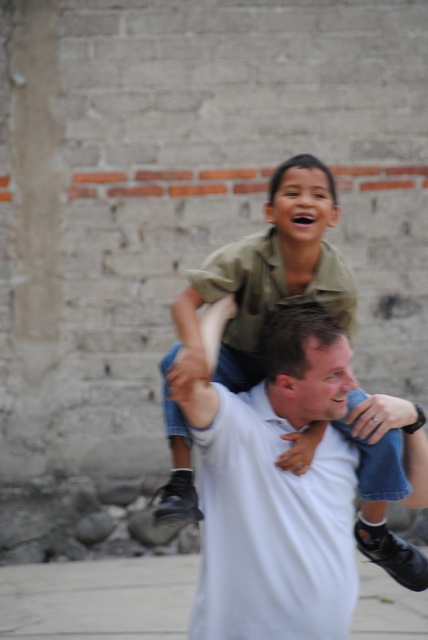
Question: Which point is closer to the camera?

Choices:
 (A) white cotton shirt at center
 (B) gray concrete pavement at lower center

Answer: (A)

Question: Is white cotton shirt at center closer to camera compared to gray concrete pavement at lower center?

Choices:
 (A) no
 (B) yes

Answer: (B)

Question: Does white cotton shirt at center appear over gray concrete pavement at lower center?

Choices:
 (A) no
 (B) yes

Answer: (B)

Question: Does white cotton shirt at center have a lesser width compared to gray concrete pavement at lower center?

Choices:
 (A) no
 (B) yes

Answer: (A)